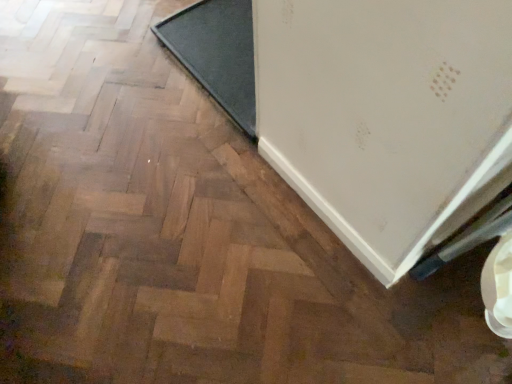
At what (x,y) coordinates should I click in order to perform the action: click on black rubber yoga mat at lower left. Please return your answer as a coordinate pair (x, y). Image resolution: width=512 pixels, height=384 pixels. Looking at the image, I should click on (217, 53).

Image resolution: width=512 pixels, height=384 pixels. Describe the element at coordinates (217, 53) in the screenshot. I see `black rubber yoga mat at lower left` at that location.

What are the coordinates of `black rubber yoga mat at lower left` in the screenshot? It's located at (217, 53).